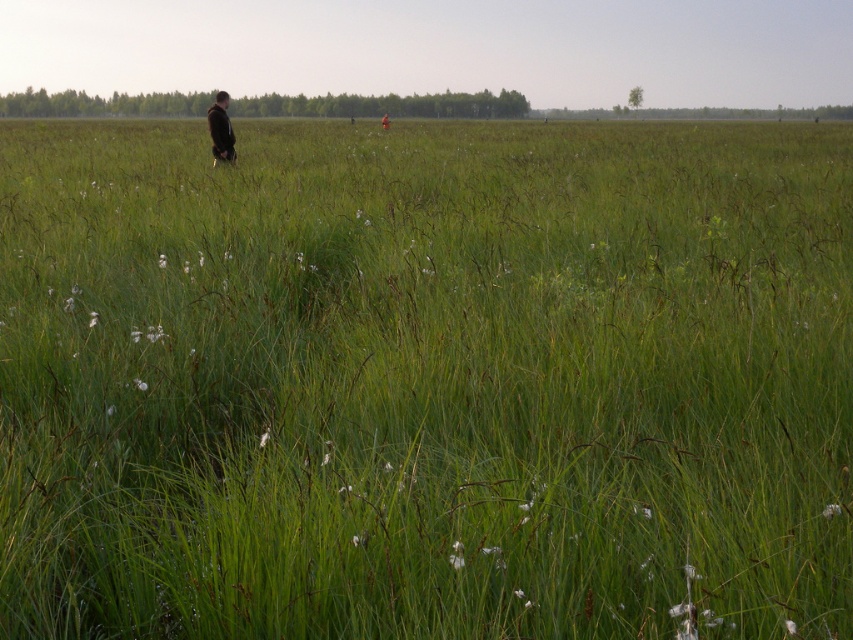
Question: Does black matte jacket at center appear on the right side of dark brown leather jacket at center?

Choices:
 (A) no
 (B) yes

Answer: (A)

Question: Is the position of black matte jacket at center more distant than that of dark brown leather jacket at center?

Choices:
 (A) yes
 (B) no

Answer: (B)

Question: Is the position of black matte jacket at center less distant than that of dark brown leather jacket at center?

Choices:
 (A) yes
 (B) no

Answer: (A)

Question: Which point is farther to the camera?

Choices:
 (A) dark brown leather jacket at center
 (B) black matte jacket at center

Answer: (A)

Question: Which object is farther from the camera taking this photo?

Choices:
 (A) dark brown leather jacket at center
 (B) black matte jacket at center

Answer: (A)

Question: Which point is farther to the camera?

Choices:
 (A) black matte jacket at center
 (B) dark brown leather jacket at center

Answer: (B)